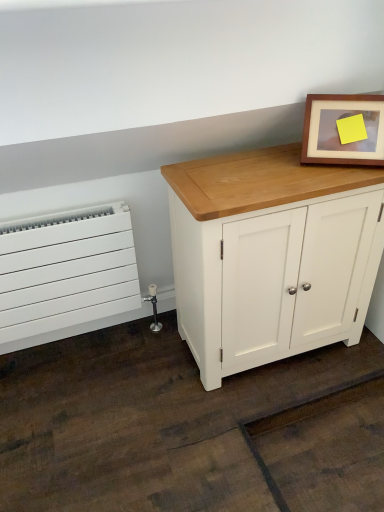
You are a GUI agent. You are given a task and a screenshot of the screen. Output one action in this format:
    pyautogui.click(x=<x>, y=<y>)
    Task: Click on the vacant area that lies in front of wooden picture frame at upper right
    This screenshot has width=384, height=512.
    Given the screenshot: What is the action you would take?
    click(339, 178)